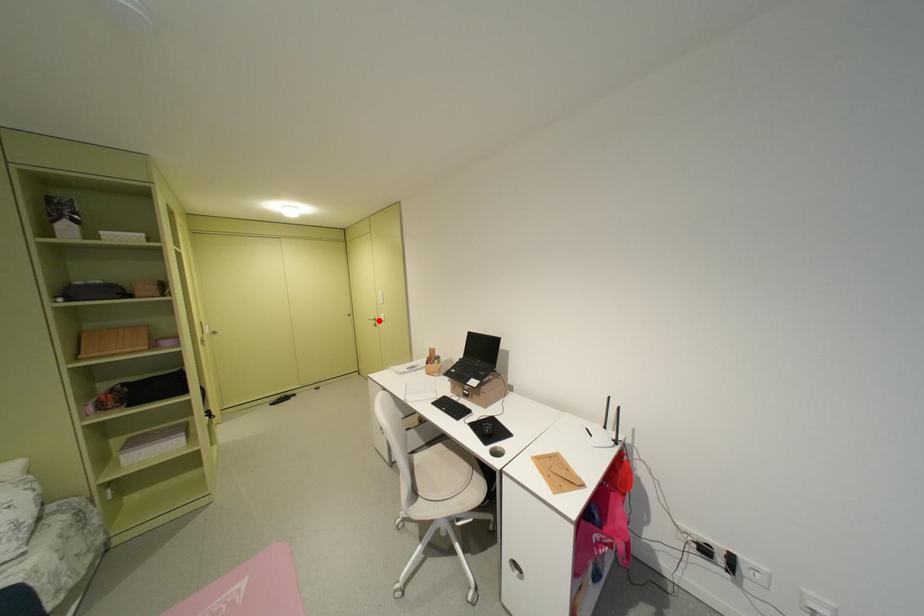
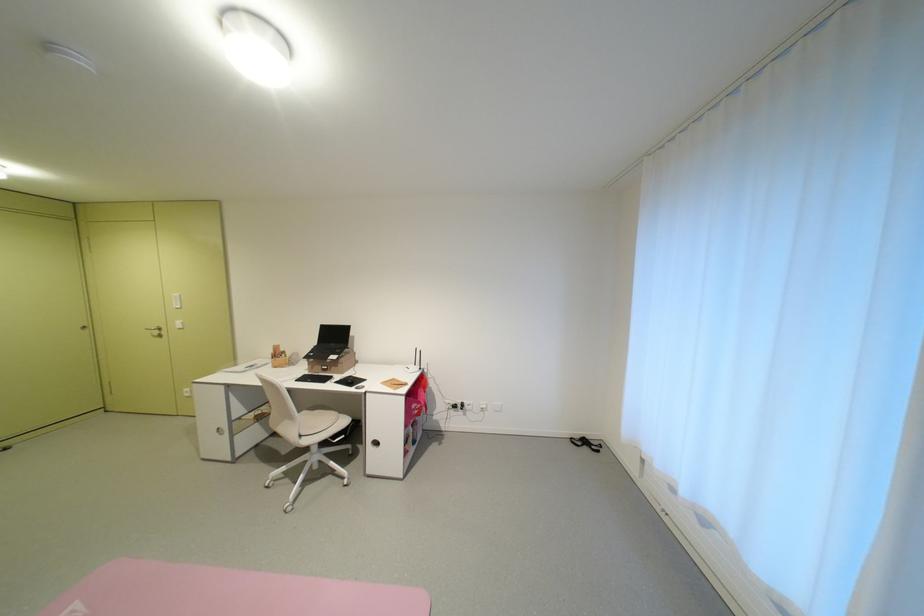
The point at the highlighted location is marked in the first image. Where is the corresponding point in the second image?

(156, 331)